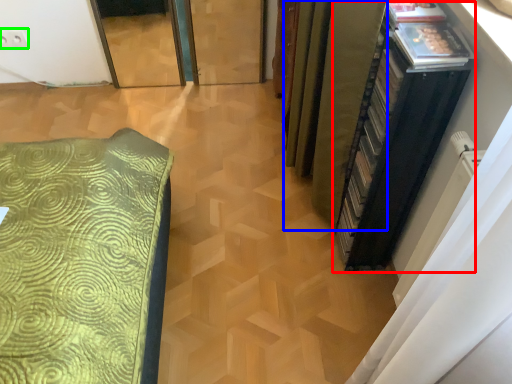
Question: Considering the real-world distances, which object is farthest from file cabinet (highlighted by a red box)? curtain (highlighted by a blue box) or electric outlet (highlighted by a green box)?

Choices:
 (A) curtain
 (B) electric outlet

Answer: (B)